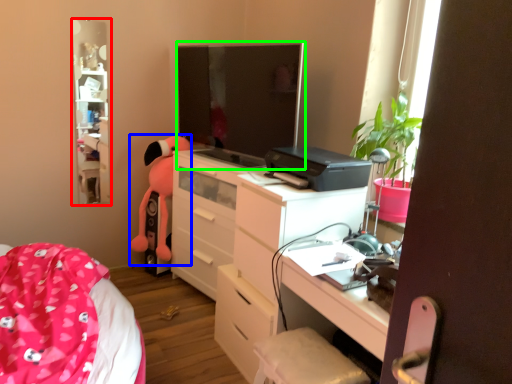
Question: Considering the real-world distances, which object is closest to tv cabinet (highlighted by a red box)? toy (highlighted by a blue box) or computer monitor (highlighted by a green box).

Choices:
 (A) toy
 (B) computer monitor

Answer: (A)